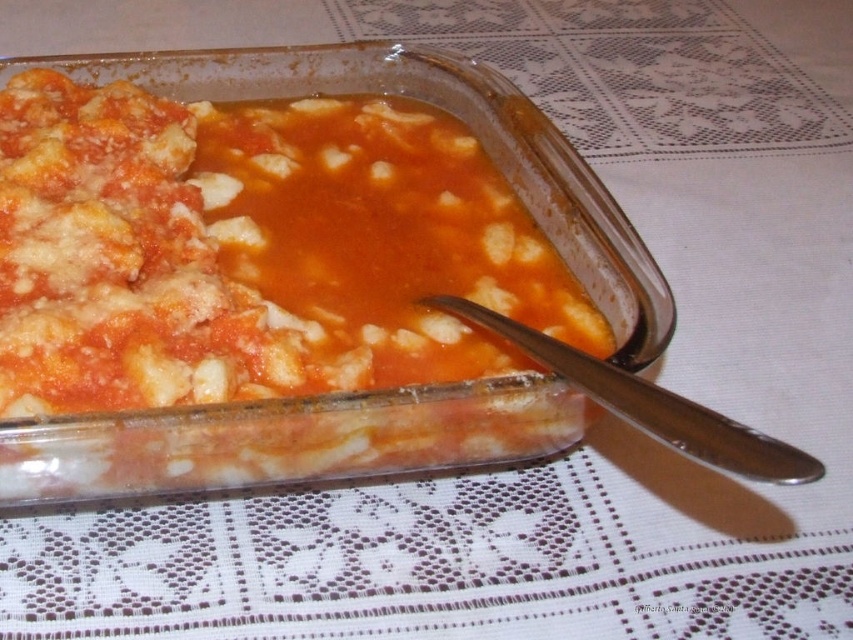
Question: Is matte tomato sauce at center wider than silver metallic spoon at lower right?

Choices:
 (A) no
 (B) yes

Answer: (B)

Question: Is matte tomato sauce at center to the left of silver metallic spoon at lower right from the viewer's perspective?

Choices:
 (A) no
 (B) yes

Answer: (B)

Question: Does matte tomato sauce at center have a lesser width compared to silver metallic spoon at lower right?

Choices:
 (A) no
 (B) yes

Answer: (A)

Question: Which point appears farthest from the camera in this image?

Choices:
 (A) (639, 404)
 (B) (67, 83)

Answer: (B)

Question: Which point is closer to the camera?

Choices:
 (A) silver metallic spoon at lower right
 (B) matte tomato sauce at center

Answer: (A)